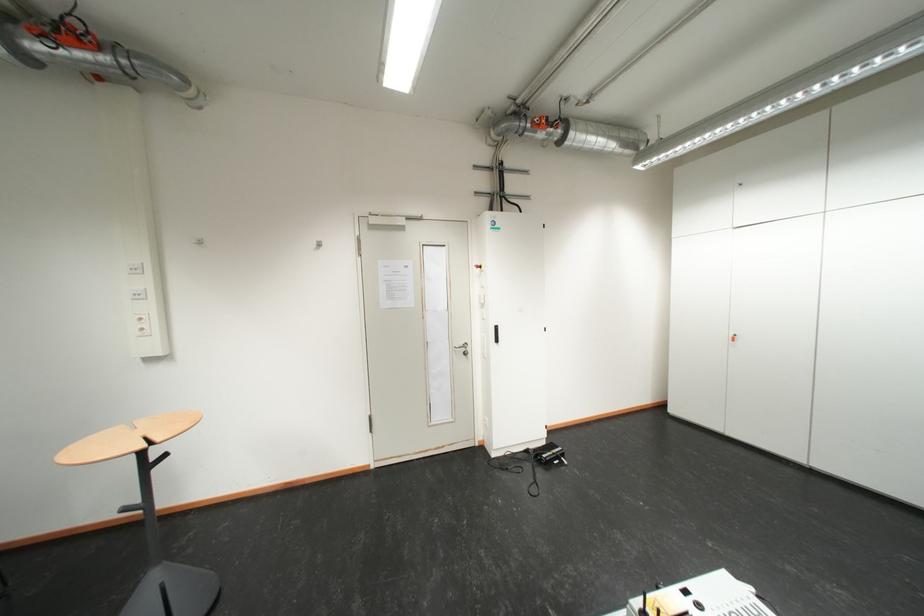
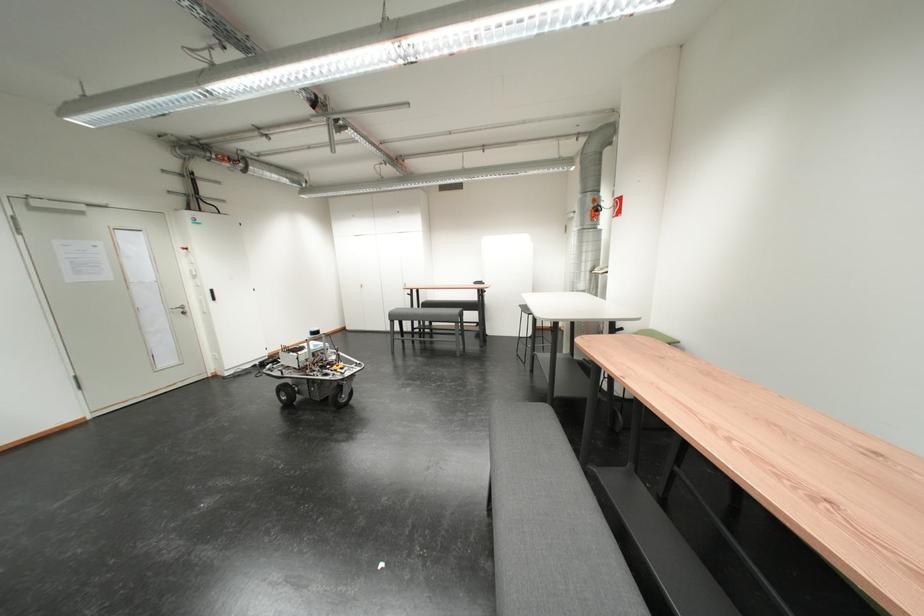
Where in the second image is the point corresponding to the point at 466,353 from the first image?

(184, 314)